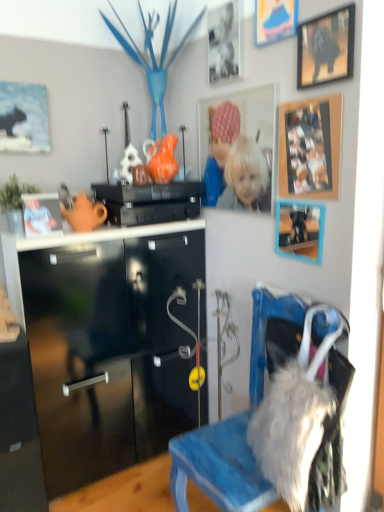
The height and width of the screenshot is (512, 384). What are the coordinates of `wooden picture frame at upper right, which ranks as the 3th picture frame in right-to-left order` in the screenshot? It's located at (300, 231).

I want to click on matte orange teapot at upper left, which appears as the 1th toy when viewed from the front, so click(x=84, y=213).

Locate an element on the screen. The image size is (384, 512). wooden photo frame at upper center, placed as the 3th picture frame when sorted from left to right is located at coordinates (244, 147).

The width and height of the screenshot is (384, 512). Describe the element at coordinates (290, 430) in the screenshot. I see `fuzzy gray fur at lower right` at that location.

Identify the location of black matte picture frame at upper center, which is the 2th picture frame in left-to-right order. tap(225, 42).

At what (x,y) coordinates should I click in order to perform the action: click on wooden picture frame at upper right, which ranks as the 3th picture frame in right-to-left order. Please return your answer as a coordinate pair (x, y). The width and height of the screenshot is (384, 512). Looking at the image, I should click on (300, 231).

How many degrees apart are the facing directions of matte black cat at upper left, which is the 1th picture frame in left-to-right order, and wooden photo frame at upper right, arranged as the 2th picture frame when viewed from the right?

The facing directions of matte black cat at upper left, which is the 1th picture frame in left-to-right order, and wooden photo frame at upper right, arranged as the 2th picture frame when viewed from the right, are 88.9 degrees apart.

From the image's perspective, relative to wooden photo frame at upper right, which is the fifth picture frame in left-to-right order, is matte black cat at upper left, which ranks as the sixth picture frame in right-to-left order, above or below?

Clearly, from the image's perspective, matte black cat at upper left, which ranks as the sixth picture frame in right-to-left order, is above wooden photo frame at upper right, which is the fifth picture frame in left-to-right order.

Is matte black cat at upper left, which ranks as the sixth picture frame in right-to-left order, positioned with its back to wooden photo frame at upper right, which is the fifth picture frame in left-to-right order?

No, matte black cat at upper left, which ranks as the sixth picture frame in right-to-left order, is not facing away from wooden photo frame at upper right, which is the fifth picture frame in left-to-right order.

Does smooth plastic toy at upper left have a greater width compared to black matte picture frame at upper center, the 5th picture frame positioned from the right?

Indeed, smooth plastic toy at upper left has a greater width compared to black matte picture frame at upper center, the 5th picture frame positioned from the right.

Can you confirm if smooth plastic toy at upper left is shorter than black matte picture frame at upper center, the 5th picture frame positioned from the right?

Yes.

In the image, is smooth plastic toy at upper left positioned in front of or behind black matte picture frame at upper center, which is the 2th picture frame in left-to-right order?

In the image, smooth plastic toy at upper left appears in front of black matte picture frame at upper center, which is the 2th picture frame in left-to-right order.

Is smooth plastic toy at upper left aimed at black matte picture frame at upper center, the 5th picture frame positioned from the right?

No, smooth plastic toy at upper left is not oriented towards black matte picture frame at upper center, the 5th picture frame positioned from the right.

Is smooth plastic toy at upper left thinner than orange glossy vase at center, placed as the first toy when sorted from top to bottom?

Indeed, smooth plastic toy at upper left has a lesser width compared to orange glossy vase at center, placed as the first toy when sorted from top to bottom.

From a real-world perspective, is smooth plastic toy at upper left located beneath orange glossy vase at center, the second toy positioned from the front?

Correct, in the physical world, smooth plastic toy at upper left is lower than orange glossy vase at center, the second toy positioned from the front.

Is smooth plastic toy at upper left inside or outside of orange glossy vase at center, placed as the first toy when sorted from top to bottom?

smooth plastic toy at upper left is located beyond the bounds of orange glossy vase at center, placed as the first toy when sorted from top to bottom.

Is the surface of smooth plastic toy at upper left in direct contact with orange glossy vase at center, acting as the second toy starting from the left?

There is a gap between smooth plastic toy at upper left and orange glossy vase at center, acting as the second toy starting from the left.

Would you say black plastic speaker at center is to the left or to the right of orange glossy vase at center, acting as the second toy starting from the bottom, in the picture?

From the image, it's evident that black plastic speaker at center is to the left of orange glossy vase at center, acting as the second toy starting from the bottom.

Is black plastic speaker at center positioned beyond the bounds of orange glossy vase at center, the second toy positioned from the front?

Yes, black plastic speaker at center is not within orange glossy vase at center, the second toy positioned from the front.

How different are the orientations of black plastic speaker at center and orange glossy vase at center, the 1th toy from the back, in degrees?

They differ by 0.000221 degrees in their facing directions.

Considering the sizes of objects orange glossy vase at center, acting as the second toy starting from the bottom, and smooth plastic toy at upper left in the image provided, who is thinner, orange glossy vase at center, acting as the second toy starting from the bottom, or smooth plastic toy at upper left?

smooth plastic toy at upper left.

Can you see orange glossy vase at center, the second toy positioned from the front, touching smooth plastic toy at upper left?

No, orange glossy vase at center, the second toy positioned from the front, is not with smooth plastic toy at upper left.

Is point (178, 166) positioned before point (25, 224)?

No, it is not.

Can you confirm if matte black cat at upper left, which ranks as the sixth picture frame in right-to-left order, is smaller than wooden picture frame at upper right, the 1th picture frame from the right?

No, matte black cat at upper left, which ranks as the sixth picture frame in right-to-left order, is not smaller than wooden picture frame at upper right, the 1th picture frame from the right.

Is matte black cat at upper left, which is the 1th picture frame in left-to-right order, looking in the opposite direction of wooden picture frame at upper right, the 1th picture frame from the right?

matte black cat at upper left, which is the 1th picture frame in left-to-right order, does not have its back to wooden picture frame at upper right, the 1th picture frame from the right.

Based on the photo, relative to wooden picture frame at upper right, which appears as the sixth picture frame when viewed from the left, is matte black cat at upper left, which is the 1th picture frame in left-to-right order, in front or behind?

matte black cat at upper left, which is the 1th picture frame in left-to-right order, is positioned farther from the viewer than wooden picture frame at upper right, which appears as the sixth picture frame when viewed from the left.

Looking at this image, is wooden picture frame at upper right, the fourth picture frame in the left-to-right sequence, next to wooden photo frame at upper center, marked as the fourth picture frame in a right-to-left arrangement, and touching it?

No, wooden picture frame at upper right, the fourth picture frame in the left-to-right sequence, is not next to wooden photo frame at upper center, marked as the fourth picture frame in a right-to-left arrangement.

In the scene shown: Is wooden picture frame at upper right, which ranks as the 3th picture frame in right-to-left order, wider or thinner than wooden photo frame at upper center, placed as the 3th picture frame when sorted from left to right?

wooden picture frame at upper right, which ranks as the 3th picture frame in right-to-left order, is wider than wooden photo frame at upper center, placed as the 3th picture frame when sorted from left to right.

Between wooden picture frame at upper right, which ranks as the 3th picture frame in right-to-left order, and wooden photo frame at upper center, marked as the fourth picture frame in a right-to-left arrangement, which one has larger size?

With larger size is wooden photo frame at upper center, marked as the fourth picture frame in a right-to-left arrangement.

Measure the distance between wooden picture frame at upper right, the fourth picture frame in the left-to-right sequence, and wooden photo frame at upper center, marked as the fourth picture frame in a right-to-left arrangement.

wooden picture frame at upper right, the fourth picture frame in the left-to-right sequence, and wooden photo frame at upper center, marked as the fourth picture frame in a right-to-left arrangement, are 29.32 centimeters apart.

What are the coordinates of `the 2nd picture frame directly above the wooden photo frame at upper right, which is the fifth picture frame in left-to-right order (from a real-world perspective)` in the screenshot? It's located at (23, 118).

The image size is (384, 512). Find the location of `the 1st picture frame behind the smooth plastic toy at upper left, counting from the anchor's position`. the 1st picture frame behind the smooth plastic toy at upper left, counting from the anchor's position is located at coordinates (225, 42).

Looking at the image, which one is located further to orange glossy vase at center, placed as the first toy when sorted from top to bottom, blue denim chair at lower right or black matte picture frame at upper center, the 5th picture frame positioned from the right?

Among the two, blue denim chair at lower right is located further to orange glossy vase at center, placed as the first toy when sorted from top to bottom.

Looking at the image, which one is located further to smooth plastic toy at upper left, matte black cat at upper left, which is the 1th picture frame in left-to-right order, or black matte picture frame at upper center, which is the 2th picture frame in left-to-right order?

Based on the image, black matte picture frame at upper center, which is the 2th picture frame in left-to-right order, appears to be further to smooth plastic toy at upper left.

When comparing their distances from blue denim chair at lower right, does smooth plastic toy at upper left or wooden photo frame at upper right, arranged as the 2th picture frame when viewed from the right, seem closer?

Based on the image, wooden photo frame at upper right, arranged as the 2th picture frame when viewed from the right, appears to be nearer to blue denim chair at lower right.

Which object lies nearer to the anchor point matte black cat at upper left, which is the 1th picture frame in left-to-right order, black plastic speaker at center or wooden picture frame at upper right, the fourth picture frame in the left-to-right sequence?

black plastic speaker at center is positioned closer to the anchor matte black cat at upper left, which is the 1th picture frame in left-to-right order.

When comparing their distances from matte orange teapot at upper left, the 1th toy in the left-to-right sequence, does matte black cat at upper left, which ranks as the sixth picture frame in right-to-left order, or wooden photo frame at upper center, placed as the 3th picture frame when sorted from left to right, seem closer?

Among the two, matte black cat at upper left, which ranks as the sixth picture frame in right-to-left order, is located nearer to matte orange teapot at upper left, the 1th toy in the left-to-right sequence.

Based on their spatial positions, is black plastic speaker at center or orange glossy vase at center, the 1th toy from the right, further from wooden picture frame at upper right, which ranks as the 3th picture frame in right-to-left order?

orange glossy vase at center, the 1th toy from the right, lies further to wooden picture frame at upper right, which ranks as the 3th picture frame in right-to-left order, than the other object.

Considering their positions, is matte orange teapot at upper left, marked as the first toy in a bottom-to-top arrangement, positioned further to wooden photo frame at upper right, arranged as the 2th picture frame when viewed from the right, than wooden photo frame at upper center, placed as the 3th picture frame when sorted from left to right?

Among the two, matte orange teapot at upper left, marked as the first toy in a bottom-to-top arrangement, is located further to wooden photo frame at upper right, arranged as the 2th picture frame when viewed from the right.

Based on their spatial positions, is wooden picture frame at upper right, the 1th picture frame from the right, or matte black cat at upper left, which ranks as the sixth picture frame in right-to-left order, further from black plastic speaker at center?

Among the two, wooden picture frame at upper right, the 1th picture frame from the right, is located further to black plastic speaker at center.

Identify the location of appliance located between smooth plastic toy at upper left and wooden photo frame at upper center, placed as the 3th picture frame when sorted from left to right, in the left-right direction. The image size is (384, 512). (x=149, y=202).

Find the location of a particular element. toy located between smooth plastic toy at upper left and black plastic speaker at center in the left-right direction is located at coordinates (84, 213).

Identify the location of appliance between black matte picture frame at upper center, which is the 2th picture frame in left-to-right order, and blue denim chair at lower right from top to bottom. (149, 202).

Image resolution: width=384 pixels, height=512 pixels. Find the location of `person between orange glossy vase at center, acting as the second toy starting from the left, and fuzzy gray fur at lower right, in the vertical direction`. person between orange glossy vase at center, acting as the second toy starting from the left, and fuzzy gray fur at lower right, in the vertical direction is located at coordinates (38, 218).